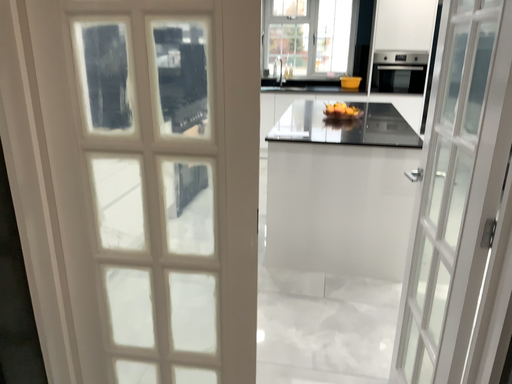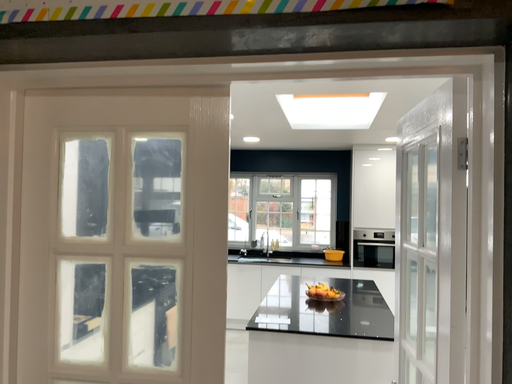
Question: Which way did the camera rotate in the video?

Choices:
 (A) rotated upward
 (B) rotated downward

Answer: (A)